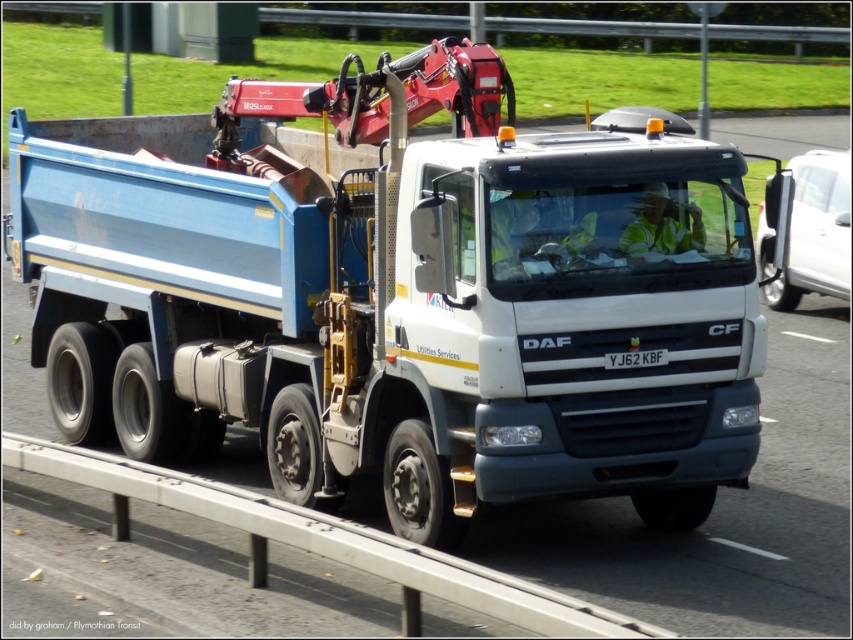
Locate an element on the screen. Image resolution: width=853 pixels, height=640 pixels. matte blue truck at center is located at coordinates pos(399,305).